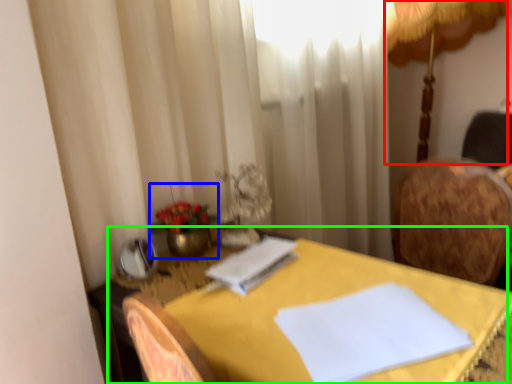
Question: Which is farther away from table lamp (highlighted by a red box)? floral arrangement (highlighted by a blue box) or table (highlighted by a green box)?

Choices:
 (A) floral arrangement
 (B) table

Answer: (A)